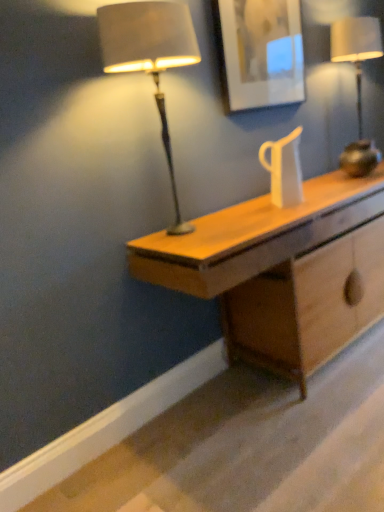
What do you see at coordinates (150, 57) in the screenshot?
I see `matte brown lamp at left, the 2th lamp from the back` at bounding box center [150, 57].

Where is `light wood desk at center`? The width and height of the screenshot is (384, 512). light wood desk at center is located at coordinates (271, 270).

The width and height of the screenshot is (384, 512). In order to click on matte white picture frame at upper center in this screenshot , I will do `click(260, 52)`.

Measure the distance between matte white picture frame at upper center and camera.

They are 1.98 meters apart.

Locate an element on the screen. The image size is (384, 512). metallic gold lamp at right, marked as the 2th lamp in a left-to-right arrangement is located at coordinates (357, 83).

Is matte brown lamp at left, positioned as the 1th lamp in left-to-right order, directly adjacent to matte white picture frame at upper center?

No, matte brown lamp at left, positioned as the 1th lamp in left-to-right order, is not making contact with matte white picture frame at upper center.

Is matte brown lamp at left, the 2th lamp from the back, bigger or smaller than matte white picture frame at upper center?

Considering their sizes, matte brown lamp at left, the 2th lamp from the back, takes up more space than matte white picture frame at upper center.

Can you confirm if matte brown lamp at left, positioned as the 1th lamp in left-to-right order, is wider than matte white picture frame at upper center?

Indeed, matte brown lamp at left, positioned as the 1th lamp in left-to-right order, has a greater width compared to matte white picture frame at upper center.

Is matte brown lamp at left, the 1th lamp when ordered from front to back, to the left or to the right of matte white picture frame at upper center in the image?

matte brown lamp at left, the 1th lamp when ordered from front to back, is positioned on matte white picture frame at upper center's left side.

From a real-world perspective, is light wood desk at center located higher than matte brown lamp at left, placed as the 2th lamp when sorted from right to left?

Actually, light wood desk at center is physically below matte brown lamp at left, placed as the 2th lamp when sorted from right to left, in the real world.

Does point (297, 292) come closer to viewer compared to point (188, 231)?

No, it is behind (188, 231).

Is light wood desk at center not inside matte brown lamp at left, the 2th lamp from the back?

Indeed, light wood desk at center is completely outside matte brown lamp at left, the 2th lamp from the back.

From the image's perspective, is light wood desk at center above matte brown lamp at left, the 2th lamp from the back?

No, from the image's perspective, light wood desk at center is not over matte brown lamp at left, the 2th lamp from the back.

Could matte brown lamp at left, the 1th lamp when ordered from front to back, be considered to be inside metallic gold lamp at right, marked as the 2th lamp in a left-to-right arrangement?

Definitely not — matte brown lamp at left, the 1th lamp when ordered from front to back, is not inside metallic gold lamp at right, marked as the 2th lamp in a left-to-right arrangement.

Is there a large distance between metallic gold lamp at right, marked as the 2th lamp in a left-to-right arrangement, and matte brown lamp at left, the 1th lamp when ordered from front to back?

metallic gold lamp at right, marked as the 2th lamp in a left-to-right arrangement, is far away from matte brown lamp at left, the 1th lamp when ordered from front to back.

Is metallic gold lamp at right, the first lamp positioned from the right, facing towards matte brown lamp at left, the 1th lamp when ordered from front to back?

No.

Which of these two, metallic gold lamp at right, acting as the 1th lamp starting from the back, or matte brown lamp at left, the 1th lamp when ordered from front to back, stands taller?

Standing taller between the two is matte brown lamp at left, the 1th lamp when ordered from front to back.

Considering the sizes of objects matte white picture frame at upper center and matte brown lamp at left, the 1th lamp when ordered from front to back, in the image provided, who is wider, matte white picture frame at upper center or matte brown lamp at left, the 1th lamp when ordered from front to back,?

matte brown lamp at left, the 1th lamp when ordered from front to back.

Between matte white picture frame at upper center and matte brown lamp at left, the 1th lamp when ordered from front to back, which one has smaller size?

matte white picture frame at upper center is smaller.

Which is more to the right, matte white picture frame at upper center or matte brown lamp at left, the 1th lamp when ordered from front to back?

Positioned to the right is matte white picture frame at upper center.

This screenshot has width=384, height=512. In order to click on picture frame above the matte brown lamp at left, the 1th lamp when ordered from front to back (from the image's perspective) in this screenshot , I will do `click(260, 52)`.

Is metallic gold lamp at right, the first lamp positioned from the right, positioned with its back to matte white picture frame at upper center?

No, metallic gold lamp at right, the first lamp positioned from the right,'s orientation is not away from matte white picture frame at upper center.

Who is more distant, metallic gold lamp at right, marked as the 2th lamp in a left-to-right arrangement, or matte white picture frame at upper center?

metallic gold lamp at right, marked as the 2th lamp in a left-to-right arrangement, is further from the camera.

Can you see metallic gold lamp at right, marked as the 2th lamp in a left-to-right arrangement, touching matte white picture frame at upper center?

No, metallic gold lamp at right, marked as the 2th lamp in a left-to-right arrangement, is not making contact with matte white picture frame at upper center.

From a real-world perspective, is metallic gold lamp at right, the first lamp positioned from the right, physically below matte white picture frame at upper center?

Yes, from a real-world perspective, metallic gold lamp at right, the first lamp positioned from the right, is below matte white picture frame at upper center.

Can you confirm if light wood desk at center is shorter than matte white picture frame at upper center?

Incorrect, the height of light wood desk at center does not fall short of that of matte white picture frame at upper center.

Are light wood desk at center and matte white picture frame at upper center far apart?

No, light wood desk at center is not far away from matte white picture frame at upper center.

Can you tell me how much light wood desk at center and matte white picture frame at upper center differ in facing direction?

0.78 degrees separate the facing orientations of light wood desk at center and matte white picture frame at upper center.

From the image's perspective, between light wood desk at center and matte white picture frame at upper center, which one is located above?

matte white picture frame at upper center, from the image's perspective.

Does matte white picture frame at upper center touch metallic gold lamp at right, the first lamp positioned from the right?

There is a gap between matte white picture frame at upper center and metallic gold lamp at right, the first lamp positioned from the right.

Considering the positions of objects matte white picture frame at upper center and metallic gold lamp at right, the second lamp when ordered from front to back, in the image provided, who is behind, matte white picture frame at upper center or metallic gold lamp at right, the second lamp when ordered from front to back,?

Positioned behind is metallic gold lamp at right, the second lamp when ordered from front to back.

Is matte white picture frame at upper center looking in the opposite direction of metallic gold lamp at right, the first lamp positioned from the right?

That's not correct — matte white picture frame at upper center is not looking away from metallic gold lamp at right, the first lamp positioned from the right.

Considering the sizes of matte white picture frame at upper center and metallic gold lamp at right, acting as the 1th lamp starting from the back, in the image, is matte white picture frame at upper center wider or thinner than metallic gold lamp at right, acting as the 1th lamp starting from the back,?

Clearly, matte white picture frame at upper center has less width compared to metallic gold lamp at right, acting as the 1th lamp starting from the back.

Find the location of `picture frame above the matte brown lamp at left, the 2th lamp from the back (from a real-world perspective)`. picture frame above the matte brown lamp at left, the 2th lamp from the back (from a real-world perspective) is located at coordinates (260, 52).

Image resolution: width=384 pixels, height=512 pixels. I want to click on lamp in front of the light wood desk at center, so click(x=150, y=57).

Considering their positions, is metallic gold lamp at right, the second lamp when ordered from front to back, positioned closer to light wood desk at center than matte white picture frame at upper center?

matte white picture frame at upper center.

From the image, which object appears to be nearer to light wood desk at center, matte white picture frame at upper center or matte brown lamp at left, the 2th lamp from the back?

Among the two, matte brown lamp at left, the 2th lamp from the back, is located nearer to light wood desk at center.

Looking at the image, which one is located closer to light wood desk at center, metallic gold lamp at right, the first lamp positioned from the right, or matte brown lamp at left, placed as the 2th lamp when sorted from right to left?

Among the two, matte brown lamp at left, placed as the 2th lamp when sorted from right to left, is located nearer to light wood desk at center.

When comparing their distances from metallic gold lamp at right, acting as the 1th lamp starting from the back, does matte white picture frame at upper center or matte brown lamp at left, the 1th lamp when ordered from front to back, seem further?

The object further to metallic gold lamp at right, acting as the 1th lamp starting from the back, is matte brown lamp at left, the 1th lamp when ordered from front to back.

Based on their spatial positions, is light wood desk at center or matte brown lamp at left, positioned as the 1th lamp in left-to-right order, further from metallic gold lamp at right, the first lamp positioned from the right?

Among the two, matte brown lamp at left, positioned as the 1th lamp in left-to-right order, is located further to metallic gold lamp at right, the first lamp positioned from the right.

Based on their spatial positions, is light wood desk at center or matte white picture frame at upper center further from matte brown lamp at left, the 1th lamp when ordered from front to back?

matte white picture frame at upper center is positioned further to the anchor matte brown lamp at left, the 1th lamp when ordered from front to back.

When comparing their distances from matte brown lamp at left, placed as the 2th lamp when sorted from right to left, does metallic gold lamp at right, the second lamp when ordered from front to back, or matte white picture frame at upper center seem further?

metallic gold lamp at right, the second lamp when ordered from front to back, is positioned further to the anchor matte brown lamp at left, placed as the 2th lamp when sorted from right to left.

Estimate the real-world distances between objects in this image. Which object is closer to matte brown lamp at left, the 1th lamp when ordered from front to back, light wood desk at center or metallic gold lamp at right, the first lamp positioned from the right?

Among the two, light wood desk at center is located nearer to matte brown lamp at left, the 1th lamp when ordered from front to back.

This screenshot has height=512, width=384. I want to click on desk between matte brown lamp at left, positioned as the 1th lamp in left-to-right order, and metallic gold lamp at right, marked as the 2th lamp in a left-to-right arrangement, in the horizontal direction, so click(x=271, y=270).

Locate an element on the screen. picture frame between matte brown lamp at left, positioned as the 1th lamp in left-to-right order, and metallic gold lamp at right, the second lamp when ordered from front to back is located at coordinates (260, 52).